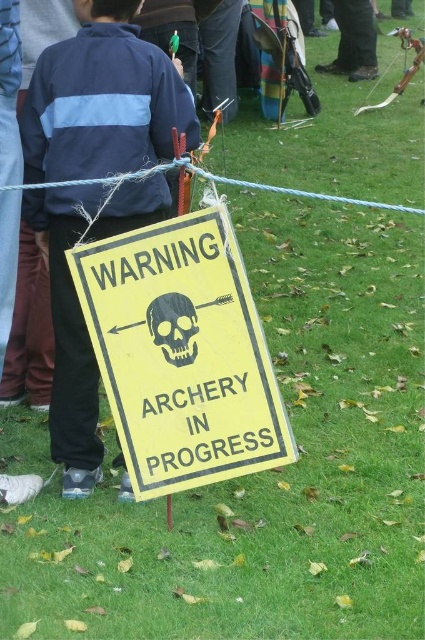
Which is behind, point (71, 320) or point (178, 332)?

The point (71, 320) is behind.

Based on the photo, is the position of blue fabric jacket at center more distant than that of black paper skull at center?

That is True.

Measure the distance between point (x=85, y=208) and camera.

Point (x=85, y=208) and camera are 8.75 feet apart.

At what (x,y) coordinates should I click in order to perform the action: click on blue fabric jacket at center. Please return your answer as a coordinate pair (x, y). This screenshot has height=640, width=425. Looking at the image, I should click on (102, 100).

In the scene shown: Between yellow paper sign at center and black paper skull at center, which one is positioned lower?

yellow paper sign at center

Between point (221, 282) and point (192, 362), which one is positioned in front?

Point (221, 282)

Image resolution: width=425 pixels, height=640 pixels. In order to click on yellow paper sign at center in this screenshot , I will do `click(181, 355)`.

Does yellow paper sign at center have a greater width compared to blue fabric jacket at center?

Yes, yellow paper sign at center is wider than blue fabric jacket at center.

Who is positioned more to the right, yellow paper sign at center or blue fabric jacket at center?

yellow paper sign at center

Locate an element on the screen. The width and height of the screenshot is (425, 640). yellow paper sign at center is located at coordinates (181, 355).